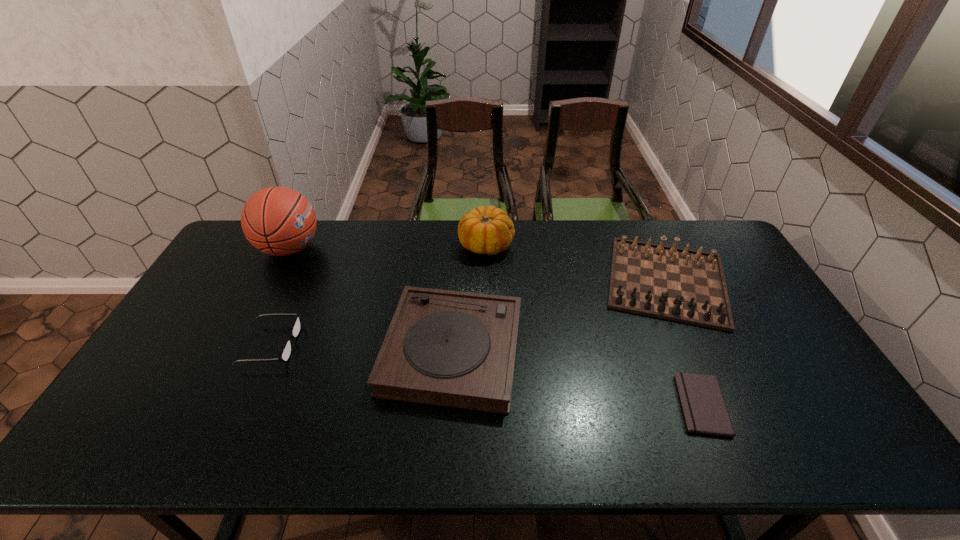
This screenshot has width=960, height=540. What are the coordinates of `vacant region located 0.150m on the front-facing side of the fifth tallest object` in the screenshot? It's located at (349, 345).

Where is `vacant space located on the right of the shortest object`? Image resolution: width=960 pixels, height=540 pixels. vacant space located on the right of the shortest object is located at coordinates (836, 405).

This screenshot has height=540, width=960. Identify the location of basketball present at the far edge. (279, 221).

I want to click on gourd that is at the far edge, so click(488, 230).

This screenshot has height=540, width=960. What are the coordinates of `chessboard located at the far edge` in the screenshot? It's located at (679, 284).

Locate an element on the screen. Image resolution: width=960 pixels, height=540 pixels. object that is at the near edge is located at coordinates (703, 406).

I want to click on object positioned at the left edge, so click(x=279, y=221).

This screenshot has height=540, width=960. I want to click on object at the right edge, so click(679, 284).

Where is `object located at the far left corner`? The image size is (960, 540). object located at the far left corner is located at coordinates (279, 221).

Where is `object that is at the far right corner`? object that is at the far right corner is located at coordinates (679, 284).